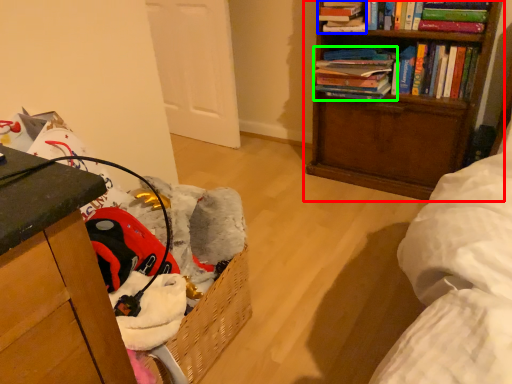
Question: Which object is the farthest from bookcase (highlighted by a red box)? Choose among these: book (highlighted by a blue box) or book (highlighted by a green box).

Choices:
 (A) book
 (B) book

Answer: (A)